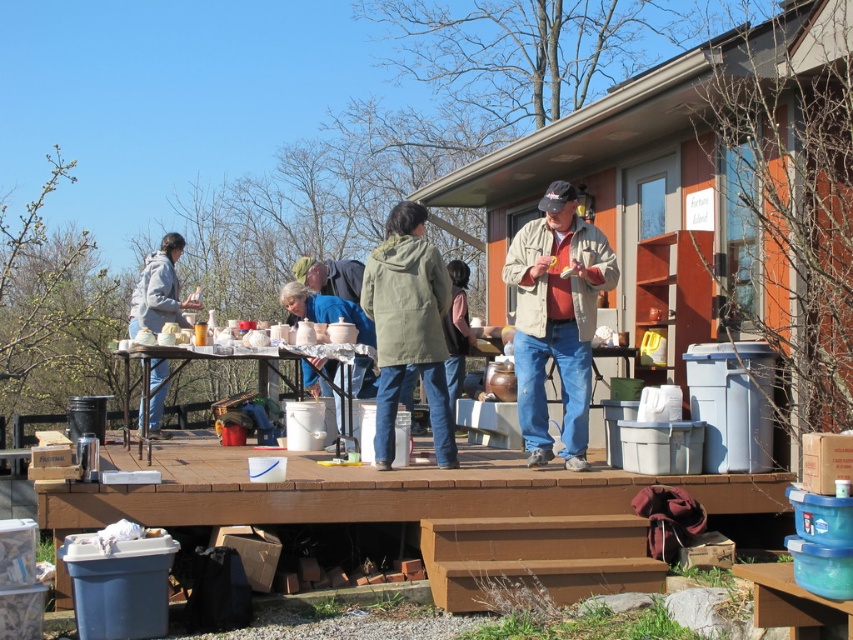
Who is positioned more to the left, brown wood deck at lower center or denim jacket at center?

From the viewer's perspective, brown wood deck at lower center appears more on the left side.

Is brown wood deck at lower center taller than denim jacket at center?

No, brown wood deck at lower center is not taller than denim jacket at center.

Between point (96, 488) and point (450, 262), which one is positioned behind?

Positioned behind is point (450, 262).

At what (x,y) coordinates should I click in order to perform the action: click on brown wood deck at lower center. Please return your answer as a coordinate pair (x, y). This screenshot has width=853, height=640. Looking at the image, I should click on (376, 492).

Is brown wood deck at lower center below tan fabric jacket at center?

Yes.

Is brown wood deck at lower center smaller than tan fabric jacket at center?

Incorrect, brown wood deck at lower center is not smaller in size than tan fabric jacket at center.

You are a GUI agent. You are given a task and a screenshot of the screen. Output one action in this format:
    pyautogui.click(x=<x>, y=<y>)
    Task: Click on the brown wood deck at lower center
    
    Given the screenshot: What is the action you would take?
    pyautogui.click(x=376, y=492)

At what (x,y) coordinates should I click in order to perform the action: click on brown wood deck at lower center. Please return your answer as a coordinate pair (x, y). This screenshot has height=640, width=853. Looking at the image, I should click on (376, 492).

Between point (236, 512) and point (161, 284), which one is positioned in front?

Point (236, 512) is more forward.

Between point (772, 480) and point (160, 364), which one is positioned behind?

The point (160, 364) is behind.

At what (x,y) coordinates should I click in order to perform the action: click on brown wood deck at lower center. Please return your answer as a coordinate pair (x, y). The image size is (853, 640). Looking at the image, I should click on (376, 492).